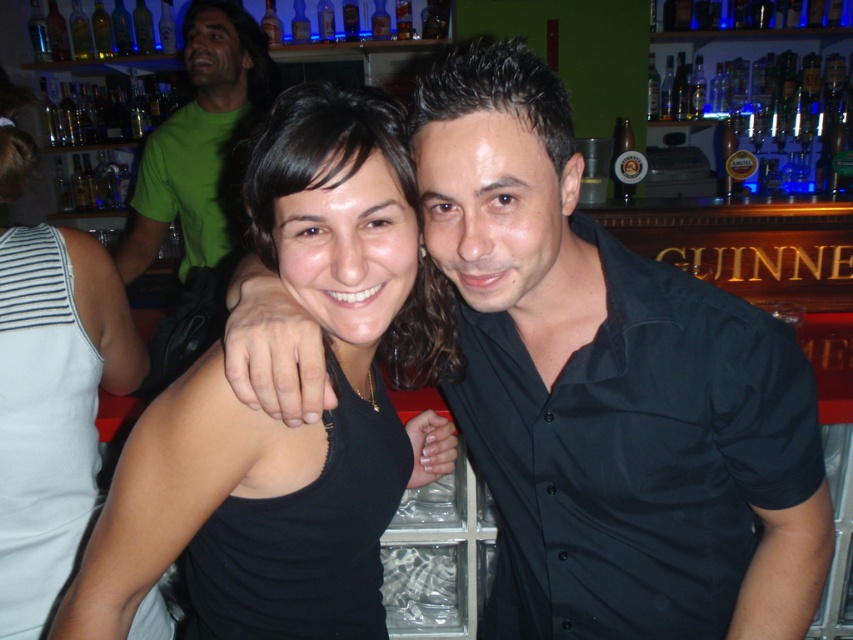
Question: Which point is closer to the camera?

Choices:
 (A) (325, 20)
 (B) (206, 276)

Answer: (B)

Question: Can you confirm if black matte shirt at center is thinner than black matte tank top at center?

Choices:
 (A) yes
 (B) no

Answer: (B)

Question: Which of these objects is positioned farthest from the clear glass bottle at upper center?

Choices:
 (A) black matte shirt at center
 (B) black tank top at center
 (C) black matte tank top at center

Answer: (A)

Question: Is black matte shirt at center above black matte tank top at center?

Choices:
 (A) no
 (B) yes

Answer: (A)

Question: Does black matte shirt at center have a smaller size compared to clear glass bottle at upper center?

Choices:
 (A) yes
 (B) no

Answer: (B)

Question: Which object is closer to the camera taking this photo?

Choices:
 (A) green matte shirt at upper left
 (B) black matte shirt at center
 (C) clear glass bottle at upper center

Answer: (B)